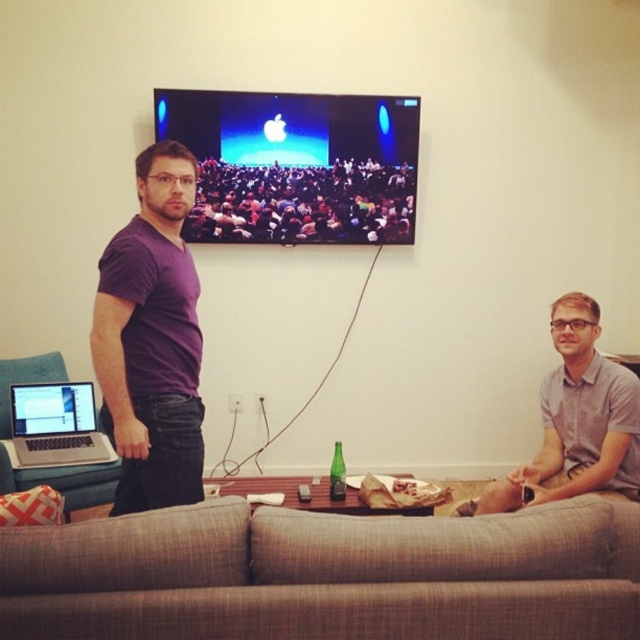
You are standing in the living room and want to move from the sofa to the window on the far wall. There are two points marked in the room. One is at coordinates point (269,193) and the other is at point (109,493). Which point should you avoid stepping on if you want to stay closer to the sofa?

You should avoid stepping on point (109,493) because point (269,193) is behind it, meaning point (109,493) is closer to the sofa and stepping on the farther point would take you away from the sofa.

You are trying to find a place to sit in this living room. The textured beige couch at lower center and the matte black crowd at upper center are both in your view. Which object is located to the right of the other?

The textured beige couch at lower center is positioned on the right side of matte black crowd at upper center.